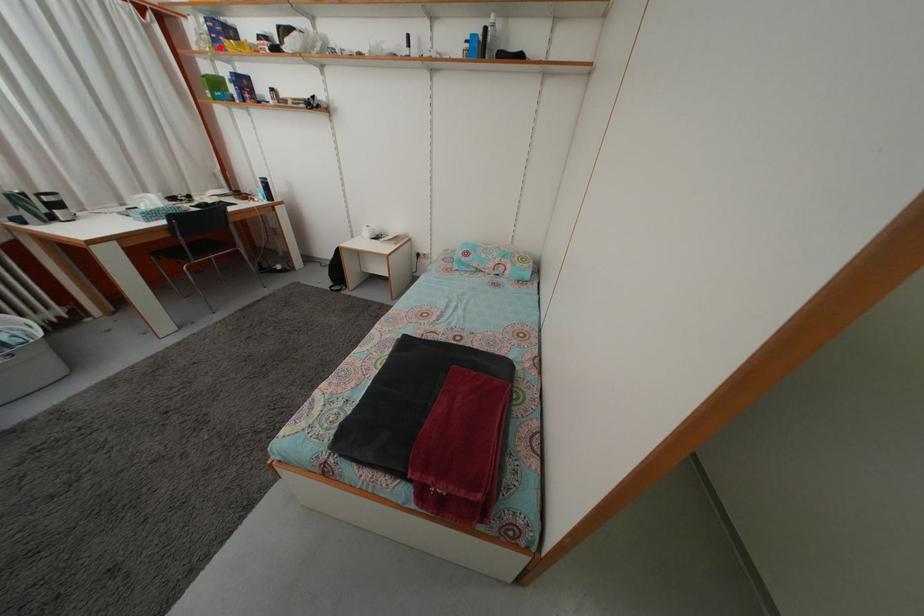
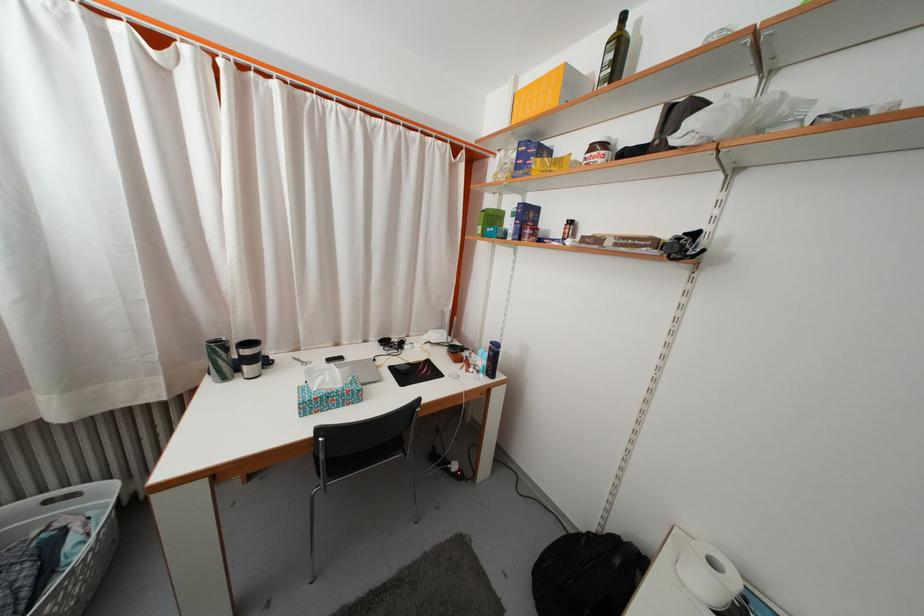
Question: I am providing you with two images of the same scene from different viewpoints. Image1 has a red point marked. In image2, the corresponding 3D location appears at what relative position? Reply with the corresponding letter.

Choices:
 (A) Closer
 (B) Farther

Answer: (A)